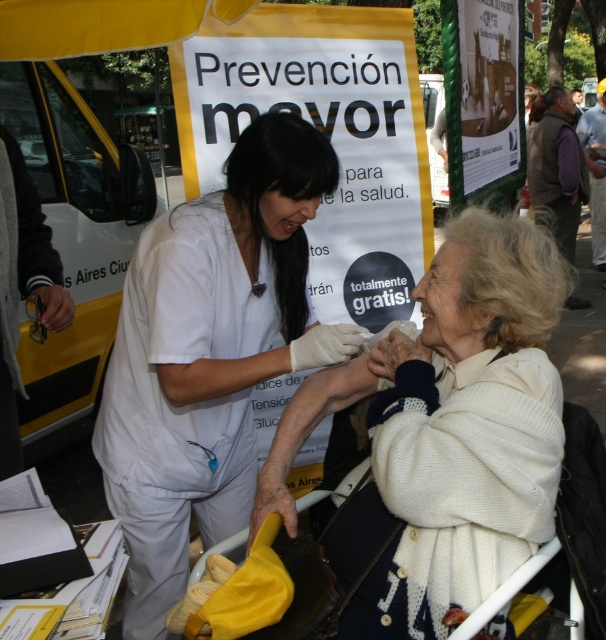
Between white knitted sweater at center and white matte uniform at center, which one has less height?

white knitted sweater at center

Is point (351, 547) positioned before point (271, 160)?

That is True.

The height and width of the screenshot is (640, 606). Describe the element at coordinates (450, 428) in the screenshot. I see `white knitted sweater at center` at that location.

In order to click on white knitted sweater at center in this screenshot , I will do `click(450, 428)`.